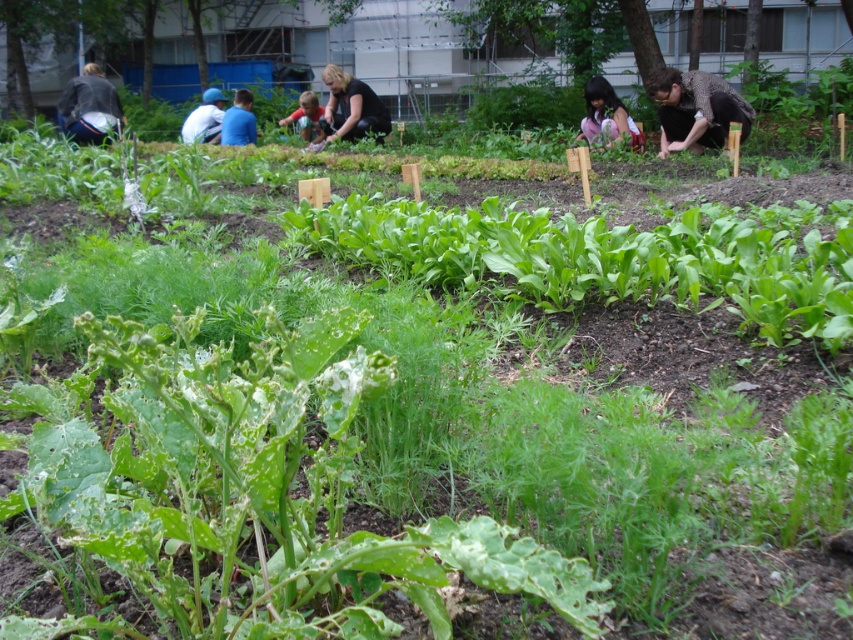
Can you confirm if dark gray jacket at upper left is smaller than black matte shirt at center?

Correct, dark gray jacket at upper left occupies less space than black matte shirt at center.

Is dark gray jacket at upper left taller than black matte shirt at center?

In fact, dark gray jacket at upper left may be shorter than black matte shirt at center.

What do you see at coordinates (90, 108) in the screenshot? Image resolution: width=853 pixels, height=640 pixels. I see `dark gray jacket at upper left` at bounding box center [90, 108].

Where is `dark gray jacket at upper left`? Image resolution: width=853 pixels, height=640 pixels. dark gray jacket at upper left is located at coordinates (90, 108).

Which of these two, dark brown hair at center or white fabric at left, stands shorter?

white fabric at left

Is point (589, 138) behind point (184, 141)?

No, (589, 138) is closer to viewer.

You are a GUI agent. You are given a task and a screenshot of the screen. Output one action in this format:
    pyautogui.click(x=<x>, y=<y>)
    Task: Click on the dark brown hair at center
    
    Given the screenshot: What is the action you would take?
    pyautogui.click(x=607, y=116)

Does point (210, 118) lie in front of point (316, 129)?

No, it is not.

Who is more forward, (201, 106) or (318, 106)?

Point (318, 106) is in front.

You are a GUI agent. You are given a task and a screenshot of the screen. Output one action in this format:
    pyautogui.click(x=<x>, y=<y>)
    Task: Click on the white fabric at left
    The width and height of the screenshot is (853, 640).
    Given the screenshot: What is the action you would take?
    pyautogui.click(x=204, y=118)